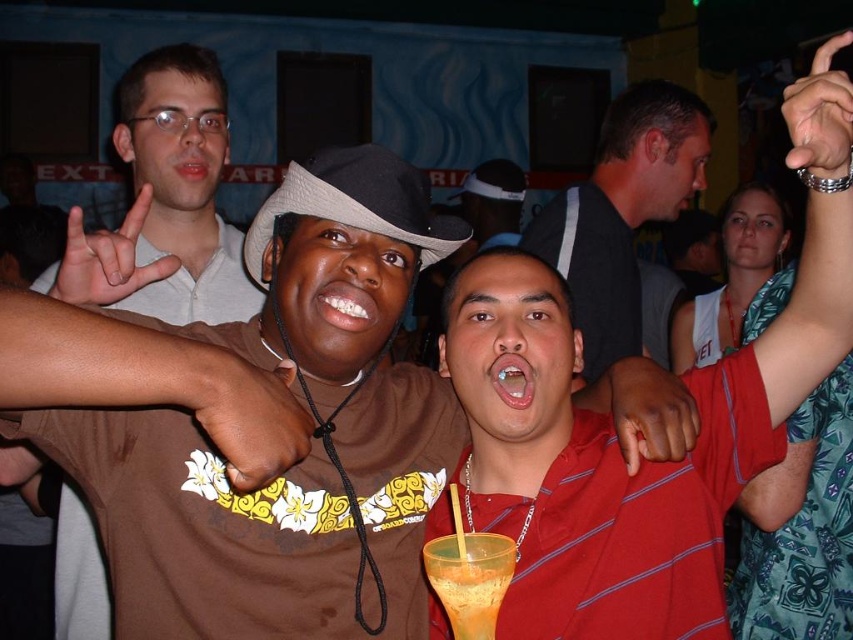
Is white matte shirt at upper left closer to the viewer compared to brown fabric cowboy hat at center?

No.

Is point (207, 253) behind point (345, 157)?

Yes, it is behind point (345, 157).

Measure the distance between point [219,125] and camera.

Point [219,125] and camera are 5.95 feet apart from each other.

This screenshot has width=853, height=640. Identify the location of white matte shirt at upper left. (183, 186).

Between white matte shirt at upper left and black matte shirt at center, which one is positioned higher?

Positioned higher is white matte shirt at upper left.

Who is more forward, (82, 524) or (631, 120)?

Point (82, 524) is in front.

Which is in front, point (206, 140) or point (608, 275)?

Positioned in front is point (206, 140).

Locate an element on the screen. white matte shirt at upper left is located at coordinates (183, 186).

Is point (553, 612) positioned before point (694, 403)?

Yes, point (553, 612) is in front of point (694, 403).

Does red striped polo shirt at center have a greater width compared to smooth red shirt at center?

Yes, red striped polo shirt at center is wider than smooth red shirt at center.

Describe the element at coordinates (618, 451) in the screenshot. I see `red striped polo shirt at center` at that location.

The height and width of the screenshot is (640, 853). Find the location of `red striped polo shirt at center`. red striped polo shirt at center is located at coordinates (618, 451).